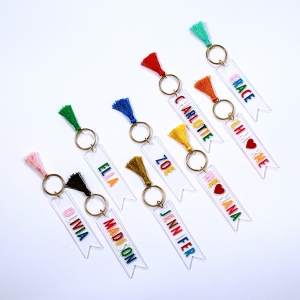
This screenshot has height=300, width=300. Identify the location of pink tassel. (33, 161).